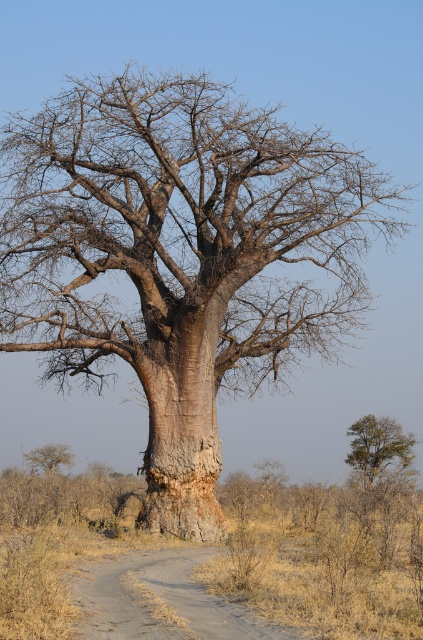
Consider the image. You are a photographer positioned at the camera viewpoint. You want to capture both the baobab tree and a specific point in the landscape. The points you need to include are point (150, 596) and point (41, 465). Given their positions, which point is closer to your camera and will appear larger in the photo?

Point (150, 596) is closer to the camera than point (41, 465), so it will appear larger in the photo.

You are a hiker trying to follow a dirt track in the arid landscape. You see the brown dirt track at lower center and the gray bark tree at lower left. Which direction should you head to stay on the track?

The brown dirt track at lower center is positioned on the right side of the gray bark tree at lower left, so to stay on the track, you should head towards the right side of the gray bark tree at lower left.

You are standing at the base of the baobab tree and see two points marked in the image. Which point, point (280, 625) or point (354, 445), is closer to you?

Point (280, 625) is closer to you because it is in front of point (354, 445).